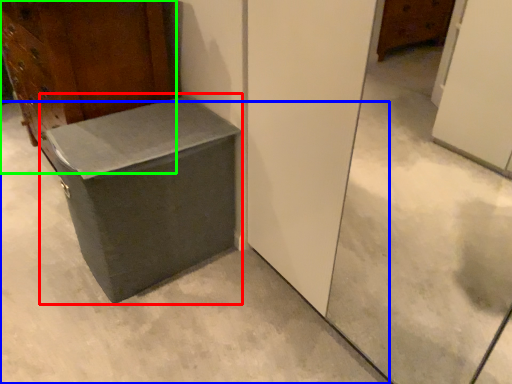
Question: Estimate the real-world distances between objects in this image. Which object is farther from cardboard box (highlighted by a red box), concrete (highlighted by a blue box) or furniture (highlighted by a green box)?

Choices:
 (A) concrete
 (B) furniture

Answer: (B)